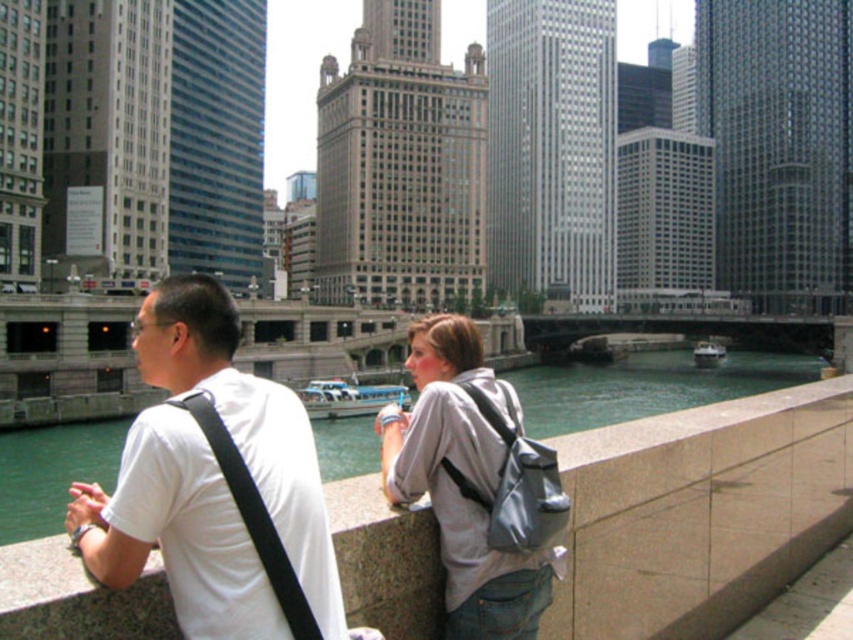
You are standing on the riverside promenade and want to sit on the smooth concrete ledge at center. However, you notice the white matte shirt at center is already occupying the space. Can you determine if there is enough room for you to sit next to them?

The smooth concrete ledge at center is to the right of the white matte shirt at center, so there might be space to sit next to them on the left side of the white matte shirt at center.

You are a photographer trying to capture a clear shot of the white matte shirt at center and the gray fabric backpack at center. Since you want to ensure both are visible, which object should you focus on first to account for their sizes?

The white matte shirt at center has a greater height compared to the gray fabric backpack at center, so you should focus on the white matte shirt at center first as it is larger and might require more attention to detail to ensure clarity.